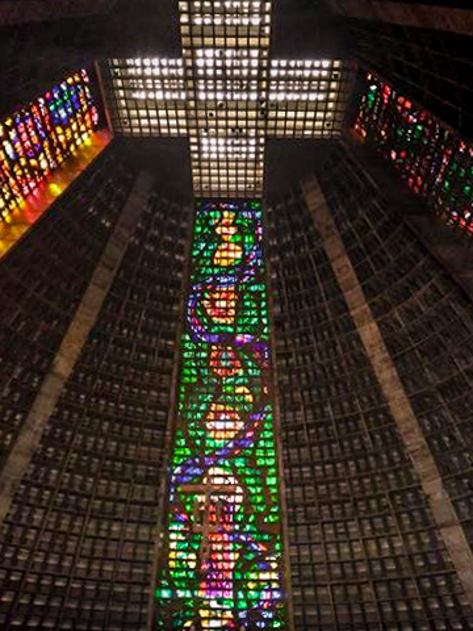
Where is `ceiling`? This screenshot has width=473, height=631. ceiling is located at coordinates (226, 69), (229, 156), (165, 71), (331, 86), (315, 27), (227, 42), (156, 28), (284, 162), (175, 154).